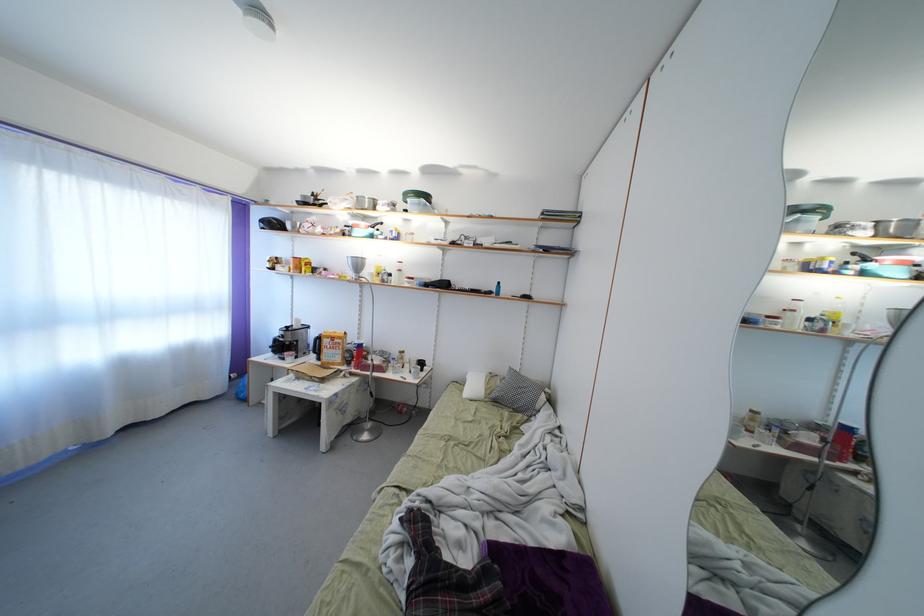
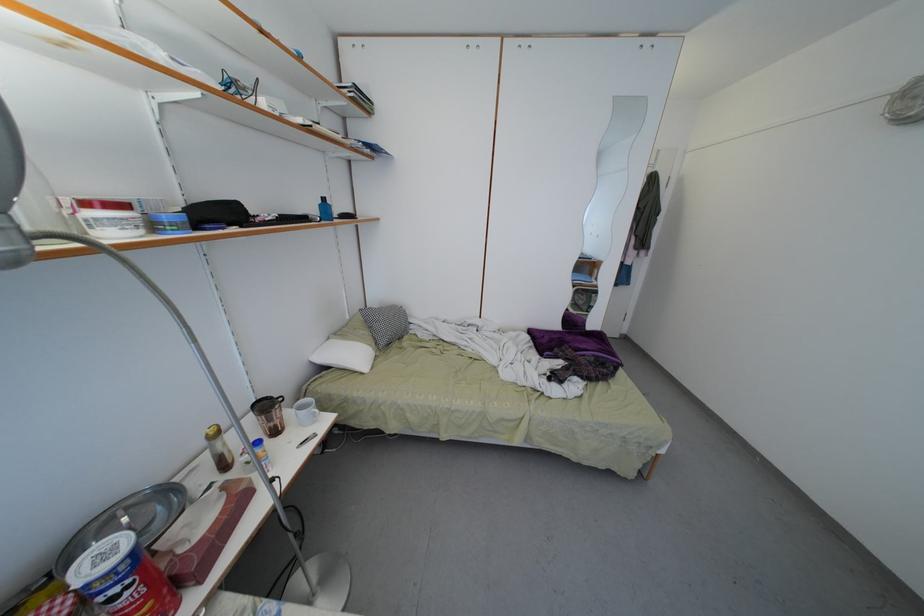
Where in the second image is the point corresponding to [505,289] from the first image?

(330, 205)